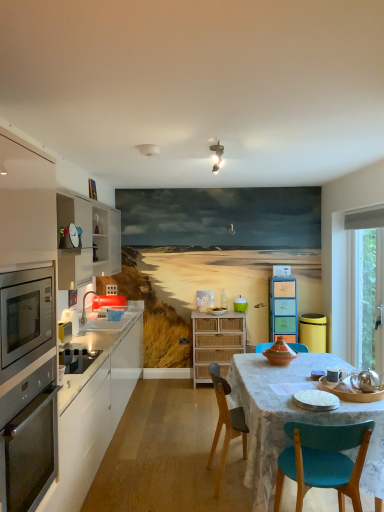
Describe the element at coordinates (281, 270) in the screenshot. This screenshot has width=384, height=512. I see `metallic microwave at center-left, which appears as the fourth appliance when ordered from the bottom` at that location.

The image size is (384, 512). Identify the location of silver metallic teapot at lower right, which appears as the 3th appliance when viewed from the back. (349, 392).

Identify the location of yellow plastic trash can at right, acting as the 4th appliance starting from the top. (313, 332).

Where is `stainless steel oven at left`? stainless steel oven at left is located at coordinates (26, 318).

What is the approximate width of wooden chair at center?

It is 19.81 inches.

The width and height of the screenshot is (384, 512). Describe the element at coordinates (225, 423) in the screenshot. I see `wooden chair at center` at that location.

What is the approximate width of metallic stainless steel oven at left?

35.95 centimeters.

Locate an element on the screen. metallic microwave at center-left, the 3th appliance positioned from the left is located at coordinates (281, 270).

Is yellow plastic trash can at right, the third appliance in the front-to-back sequence, far away from transparent glass window at right?

No, yellow plastic trash can at right, the third appliance in the front-to-back sequence, is in close proximity to transparent glass window at right.

Find the location of a particular element. window screen in front of the yellow plastic trash can at right, which is the 2th appliance in back-to-front order is located at coordinates (366, 298).

Measure the distance between yellow plastic trash can at right, which is the 2th appliance in back-to-front order, and transparent glass window at right.

A distance of 22.53 inches exists between yellow plastic trash can at right, which is the 2th appliance in back-to-front order, and transparent glass window at right.

From a real-world perspective, who is located higher, yellow plastic trash can at right, which is the first appliance from right to left, or transparent glass window at right?

transparent glass window at right is physically above.

Is white ceramic plates at center, the first appliance in the left-to-right sequence, oriented towards white marble table at center?

No, white ceramic plates at center, the first appliance in the left-to-right sequence, is not aimed at white marble table at center.

Considering the sizes of objects white ceramic plates at center, the 4th appliance in the back-to-front sequence, and white marble table at center in the image provided, who is taller, white ceramic plates at center, the 4th appliance in the back-to-front sequence, or white marble table at center?

white marble table at center is taller.

Can we say white ceramic plates at center, the first appliance in the left-to-right sequence, lies outside white marble table at center?

No, white ceramic plates at center, the first appliance in the left-to-right sequence, is inside white marble table at center's boundary.

Relative to white marble table at center, is white ceramic plates at center, arranged as the fourth appliance when viewed from the right, in front or behind?

white ceramic plates at center, arranged as the fourth appliance when viewed from the right, is behind white marble table at center.

In the scene shown: Is pastel wood drawers at center, the 3th cabinetry in the left-to-right sequence, taller than yellow plastic trash can at right, acting as the 4th appliance starting from the top?

Answer: Correct, pastel wood drawers at center, the 3th cabinetry in the left-to-right sequence, is much taller as yellow plastic trash can at right, acting as the 4th appliance starting from the top.

Is pastel wood drawers at center, positioned as the 1th cabinetry in right-to-left order, touching yellow plastic trash can at right, which is the 2th appliance in back-to-front order?

No, pastel wood drawers at center, positioned as the 1th cabinetry in right-to-left order, is not next to yellow plastic trash can at right, which is the 2th appliance in back-to-front order.

From the image's perspective, is pastel wood drawers at center, the 3th cabinetry in the left-to-right sequence, located above or below yellow plastic trash can at right, which is the 4th appliance from left to right?

Clearly, from the image's perspective, pastel wood drawers at center, the 3th cabinetry in the left-to-right sequence, is above yellow plastic trash can at right, which is the 4th appliance from left to right.

Which of these two, wooden chair at center or silver metallic teapot at lower right, the 2th appliance viewed from the left, is smaller?

silver metallic teapot at lower right, the 2th appliance viewed from the left, is smaller.

Can you confirm if wooden chair at center is taller than silver metallic teapot at lower right, the 2th appliance viewed from the left?

Indeed, wooden chair at center has a greater height compared to silver metallic teapot at lower right, the 2th appliance viewed from the left.

From a real-world perspective, is wooden chair at center physically located above or below silver metallic teapot at lower right, which appears as the 3th appliance when viewed from the back?

Clearly, from a real-world perspective, wooden chair at center is below silver metallic teapot at lower right, which appears as the 3th appliance when viewed from the back.

Is wooden chair at center looking in the opposite direction of silver metallic teapot at lower right, acting as the 3th appliance starting from the right?

wooden chair at center does not have its back to silver metallic teapot at lower right, acting as the 3th appliance starting from the right.

Which of these two, white marble table at center or wooden chair at center, is wider?

white marble table at center is wider.

Based on the photo, is white marble table at center to the left or to the right of wooden chair at center in the image?

In the image, white marble table at center appears on the right side of wooden chair at center.

From the image's perspective, which is below, white marble table at center or wooden chair at center?

white marble table at center is shown below in the image.

Who is more distant, white marble table at center or wooden chair at center?

wooden chair at center is further from the camera.

Looking at this image, based on their positions, is white ceramic plates at center, arranged as the fourth appliance when viewed from the right, located to the left or right of white matte cabinet at left, which is the first cabinetry from left to right?

From the image, it's evident that white ceramic plates at center, arranged as the fourth appliance when viewed from the right, is to the right of white matte cabinet at left, which is the first cabinetry from left to right.

From a real-world perspective, which is physically above, white ceramic plates at center, placed as the 1th appliance when sorted from front to back, or white matte cabinet at left, which is the first cabinetry from left to right?

white ceramic plates at center, placed as the 1th appliance when sorted from front to back, is physically above.

Between point (312, 403) and point (109, 434), which one is positioned in front?

The point (312, 403) is closer.

From the image's perspective, which is above, teal plastic container at center or white marble table at center?

From the image's view, teal plastic container at center is above.

Is teal plastic container at center in front of or behind white marble table at center in the image?

Clearly, teal plastic container at center is behind white marble table at center.

Does point (246, 309) appear closer or farther from the camera than point (277, 423)?

Point (246, 309) is positioned farther from the camera compared to point (277, 423).

At what (x,y) coordinates should I click in order to perform the action: click on the 1st appliance to the left when counting from the transparent glass window at right. Please return your answer as a coordinate pair (x, y). The height and width of the screenshot is (512, 384). Looking at the image, I should click on (313, 332).

Locate an element on the screen. This screenshot has height=512, width=384. the 3rd appliance positioned above the white marble table at center (from a real-world perspective) is located at coordinates (315, 400).

Which object lies nearer to the anchor point white ceramic plates at center, the 4th appliance in the back-to-front sequence, yellow plastic trash can at right, the third appliance in the front-to-back sequence, or white matte cabinet at left, marked as the third cabinetry in a right-to-left arrangement?

white matte cabinet at left, marked as the third cabinetry in a right-to-left arrangement.

Which object lies further to the anchor point metallic microwave at center-left, positioned as the 4th appliance in front-to-back order, pastel wood drawers at center, the 3th cabinetry in the left-to-right sequence, or metallic stainless steel oven at left?

metallic stainless steel oven at left.

From the image, which object appears to be farther from white marble table at center, yellow plastic trash can at right, which is the 2th appliance in back-to-front order, or metallic stainless steel oven at left?

yellow plastic trash can at right, which is the 2th appliance in back-to-front order, is positioned further to the anchor white marble table at center.

Which object lies nearer to the anchor point white matte cabinet at left, which is the first cabinetry from left to right, yellow plastic trash can at right, which is the first appliance from right to left, or white glossy sink at left?

white glossy sink at left is closer to white matte cabinet at left, which is the first cabinetry from left to right.

Considering their positions, is white glossy sink at left positioned further to metallic stainless steel oven at left than pastel wood drawers at center, positioned as the 1th cabinetry in right-to-left order?

pastel wood drawers at center, positioned as the 1th cabinetry in right-to-left order, is positioned further to the anchor metallic stainless steel oven at left.

When comparing their distances from teal plastic container at center, does pastel wood drawers at center, the 3th cabinetry in the left-to-right sequence, or yellow plastic trash can at right, which is the 4th appliance from left to right, seem closer?

Among the two, pastel wood drawers at center, the 3th cabinetry in the left-to-right sequence, is located nearer to teal plastic container at center.

Consider the image. Which object lies nearer to the anchor point white ceramic plates at center, arranged as the fourth appliance when viewed from the right, woven wood cabinet at center, the second cabinetry viewed from the left, or yellow plastic trash can at right, the first appliance ordered from the bottom?

woven wood cabinet at center, the second cabinetry viewed from the left, lies closer to white ceramic plates at center, arranged as the fourth appliance when viewed from the right, than the other object.

When comparing their distances from metallic stainless steel oven at left, does wooden chair at center or yellow plastic trash can at right, which is the first appliance from right to left, seem closer?

Based on the image, wooden chair at center appears to be nearer to metallic stainless steel oven at left.

Locate an element on the screen. The width and height of the screenshot is (384, 512). kitchen & dining room table between white matte cabinet at left, marked as the third cabinetry in a right-to-left arrangement, and metallic microwave at center-left, which appears as the fourth appliance when ordered from the bottom, along the z-axis is located at coordinates (293, 418).

At what (x,y) coordinates should I click in order to perform the action: click on chair positioned between white ceramic plates at center, the first appliance in the left-to-right sequence, and yellow plastic trash can at right, acting as the 4th appliance starting from the top, from near to far. Please return your answer as a coordinate pair (x, y). Looking at the image, I should click on (225, 423).

This screenshot has width=384, height=512. Find the location of `sink positioned between stainless steel oven at left and yellow plastic trash can at right, acting as the 4th appliance starting from the top, from near to far`. sink positioned between stainless steel oven at left and yellow plastic trash can at right, acting as the 4th appliance starting from the top, from near to far is located at coordinates (105, 313).

Locate an element on the screen. This screenshot has height=512, width=384. appliance between white ceramic plates at center, the 4th appliance in the back-to-front sequence, and transparent glass window at right in the front-back direction is located at coordinates (349, 392).